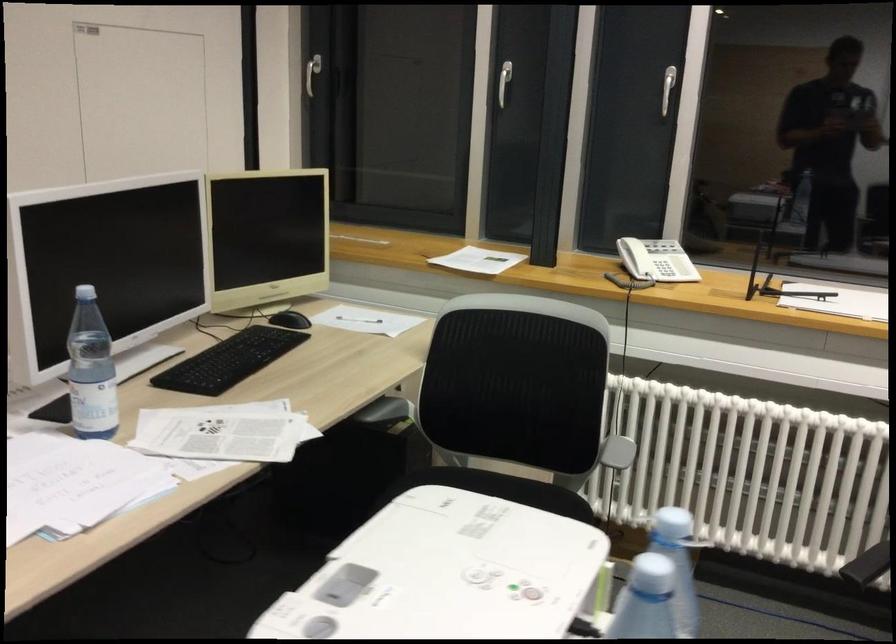
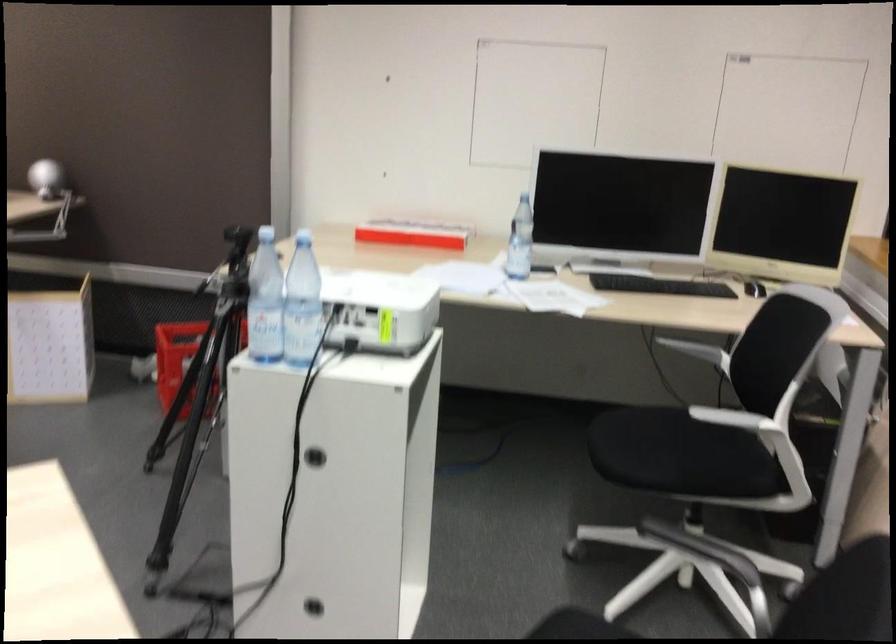
In the second image, find the point that corresponds to point 599,444 in the first image.

(733, 418)